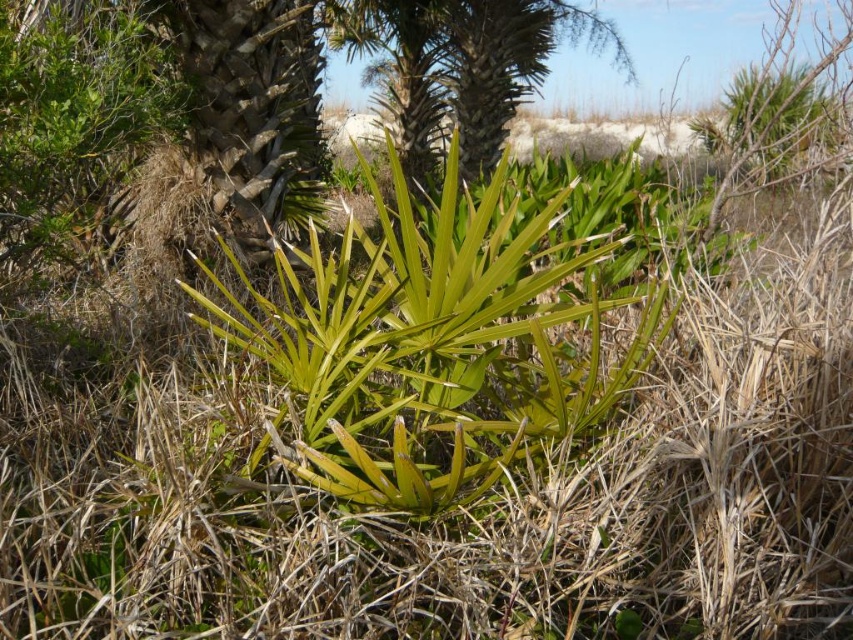
Question: Which point is farther from the camera taking this photo?

Choices:
 (A) (532, 323)
 (B) (424, 54)

Answer: (B)

Question: Which of the following is the farthest from the observer?

Choices:
 (A) (422, 16)
 (B) (576, 371)

Answer: (A)

Question: Is green leafy plant at center further to camera compared to green leafy palm tree at center?

Choices:
 (A) no
 (B) yes

Answer: (A)

Question: From the image, what is the correct spatial relationship of green leafy plant at center in relation to green leafy palm tree at center?

Choices:
 (A) above
 (B) below

Answer: (B)

Question: Is green leafy plant at center positioned behind green leafy palm tree at center?

Choices:
 (A) no
 (B) yes

Answer: (A)